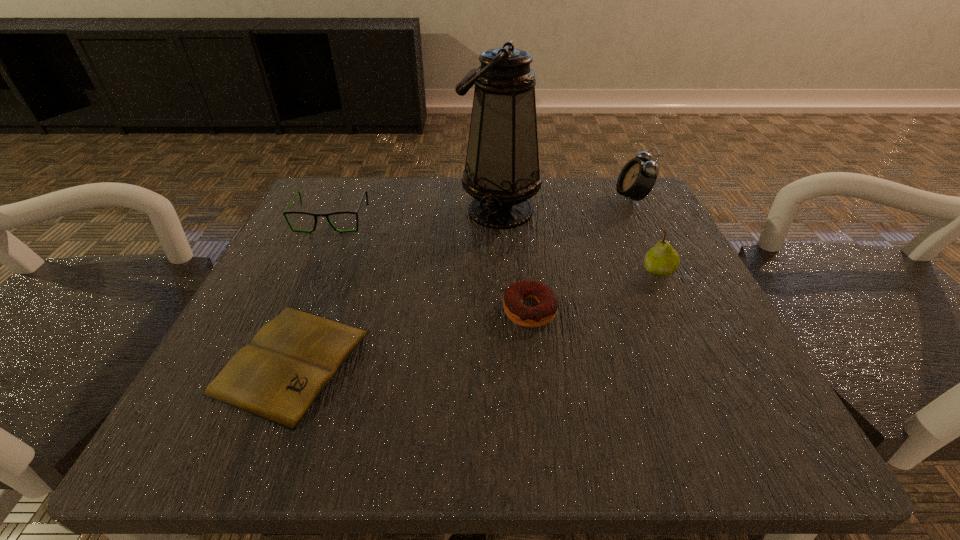
You are a GUI agent. You are given a task and a screenshot of the screen. Output one action in this format:
    pyautogui.click(x=<x>, y=<y>)
    Task: Click on the free space located on the face of the alarm clock
    This screenshot has height=540, width=960.
    Given the screenshot: What is the action you would take?
    pyautogui.click(x=570, y=198)

Locate an element on the screen. blank area located on the back of the pear is located at coordinates (618, 186).

You are a GUI agent. You are given a task and a screenshot of the screen. Output one action in this format:
    pyautogui.click(x=<x>, y=<y>)
    Task: Click on the vacant area situated 0.270m on the lens of the spectacles
    
    Given the screenshot: What is the action you would take?
    pyautogui.click(x=277, y=338)

Where is `free spot located on the front of the fifth tallest object`? This screenshot has height=540, width=960. free spot located on the front of the fifth tallest object is located at coordinates (546, 450).

The height and width of the screenshot is (540, 960). What are the coordinates of `vacant region located on the back of the book` in the screenshot? It's located at (353, 207).

Identify the location of oil lamp located at the far edge. This screenshot has width=960, height=540. (501, 172).

At what (x,y) coordinates should I click in order to perform the action: click on alarm clock located at the far edge. Please return your answer as a coordinate pair (x, y). Looking at the image, I should click on (637, 178).

Find the location of a particular element. Image resolution: width=960 pixels, height=540 pixels. spectacles at the far edge is located at coordinates (285, 212).

This screenshot has width=960, height=540. I want to click on object at the near edge, so click(x=278, y=376).

Where is `spectacles that is at the left edge`? spectacles that is at the left edge is located at coordinates pyautogui.click(x=285, y=212).